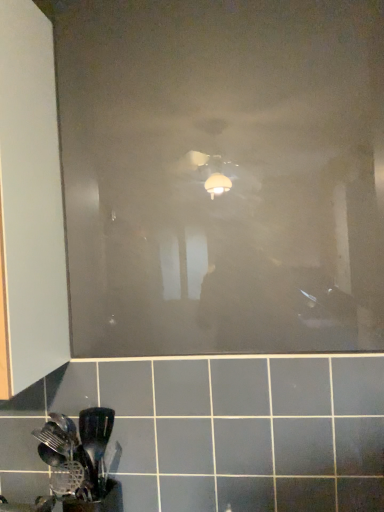
Question: Can you confirm if transparent matte glass door at center is shorter than black plastic spatula at lower left?

Choices:
 (A) no
 (B) yes

Answer: (A)

Question: Is the position of transparent matte glass door at center less distant than that of black plastic spatula at lower left?

Choices:
 (A) no
 (B) yes

Answer: (A)

Question: Does transparent matte glass door at center touch black plastic spatula at lower left?

Choices:
 (A) no
 (B) yes

Answer: (A)

Question: Is transparent matte glass door at center not within black plastic spatula at lower left?

Choices:
 (A) no
 (B) yes

Answer: (B)

Question: Is transparent matte glass door at center behind black plastic spatula at lower left?

Choices:
 (A) no
 (B) yes

Answer: (B)

Question: From a real-world perspective, is black plastic spatula at lower left above or below matte white cabinet at left?

Choices:
 (A) below
 (B) above

Answer: (A)

Question: Is point (76, 434) closer or farther from the camera than point (13, 314)?

Choices:
 (A) farther
 (B) closer

Answer: (A)

Question: From their relative heights in the image, would you say black plastic spatula at lower left is taller or shorter than matte white cabinet at left?

Choices:
 (A) tall
 (B) short

Answer: (B)

Question: From the image's perspective, is black plastic spatula at lower left above or below matte white cabinet at left?

Choices:
 (A) above
 (B) below

Answer: (B)

Question: In terms of height, does black plastic spatula at lower left look taller or shorter compared to transparent matte glass door at center?

Choices:
 (A) short
 (B) tall

Answer: (A)

Question: Do you think black plastic spatula at lower left is within transparent matte glass door at center, or outside of it?

Choices:
 (A) outside
 (B) inside

Answer: (A)

Question: In the image, is black plastic spatula at lower left positioned in front of or behind transparent matte glass door at center?

Choices:
 (A) behind
 (B) front

Answer: (B)

Question: Looking at the image, does black plastic spatula at lower left seem bigger or smaller compared to transparent matte glass door at center?

Choices:
 (A) big
 (B) small

Answer: (B)

Question: From a real-world perspective, is matte white cabinet at left above or below transparent matte glass door at center?

Choices:
 (A) above
 (B) below

Answer: (B)

Question: Choose the correct answer: Is matte white cabinet at left inside transparent matte glass door at center or outside it?

Choices:
 (A) inside
 (B) outside

Answer: (B)